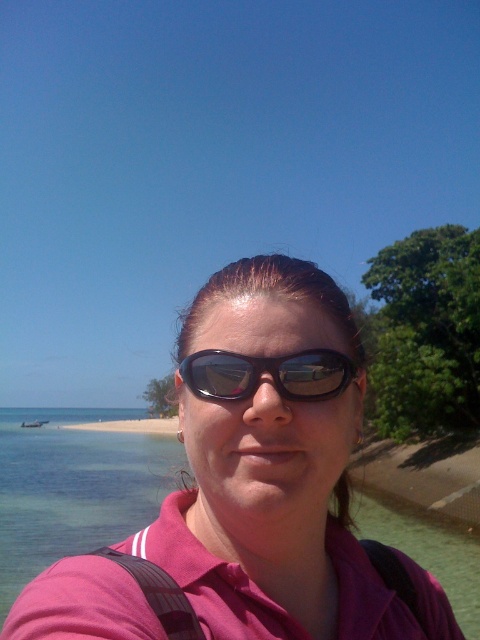
Can you confirm if clear water at beach front is taller than sunglasses at center?

Yes, clear water at beach front is taller than sunglasses at center.

Which is in front, point (453, 604) or point (225, 378)?

Positioned in front is point (225, 378).

Is point (120, 452) less distant than point (205, 349)?

No, it is not.

Where is `clear water at beach front`? The height and width of the screenshot is (640, 480). clear water at beach front is located at coordinates (72, 488).